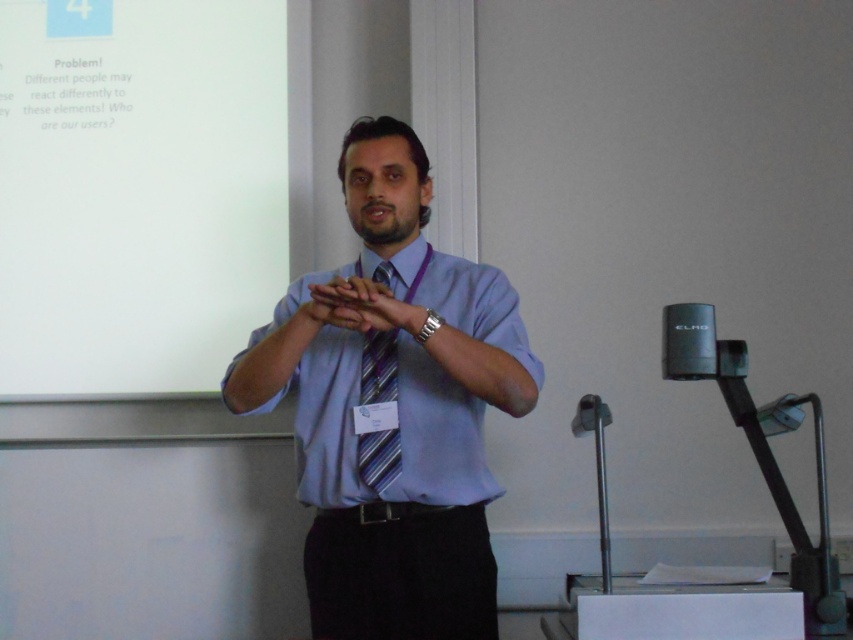
Question: Which of the following is the farthest from the observer?

Choices:
 (A) (347, 294)
 (B) (444, 372)
 (C) (375, 372)

Answer: (C)

Question: Which point is closer to the camera?

Choices:
 (A) matte purple tie at center
 (B) black matte microphone at lower right

Answer: (A)

Question: Does white matte projection screen at upper left have a larger size compared to black matte microphone at lower right?

Choices:
 (A) no
 (B) yes

Answer: (B)

Question: Estimate the real-world distances between objects in this image. Which object is farther from the matte purple tie at center?

Choices:
 (A) striped fabric tie at center
 (B) matte blue shirt at center
 (C) white matte projection screen at upper left
 (D) black matte microphone at lower right

Answer: (C)

Question: Does striped fabric tie at center appear under black matte microphone at lower right?

Choices:
 (A) no
 (B) yes

Answer: (A)

Question: Can you confirm if matte blue shirt at center is positioned to the left of matte purple tie at center?

Choices:
 (A) no
 (B) yes

Answer: (A)